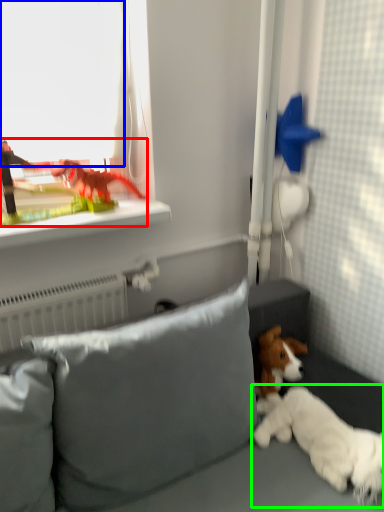
Question: Based on their relative distances, which object is nearer to toy (highlighted by a red box)? Choose from window screen (highlighted by a blue box) and dog (highlighted by a green box).

Choices:
 (A) window screen
 (B) dog

Answer: (A)